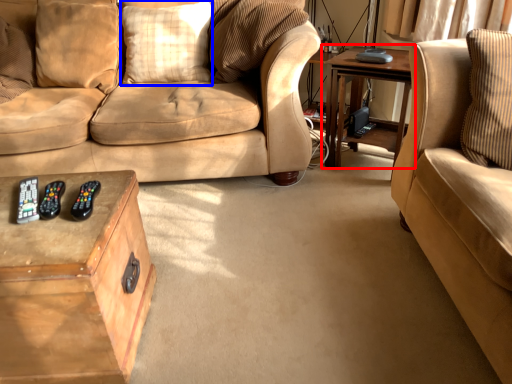
Question: Which object is closer to the camera taking this photo, table (highlighted by a red box) or pillow (highlighted by a blue box)?

Choices:
 (A) table
 (B) pillow

Answer: (A)